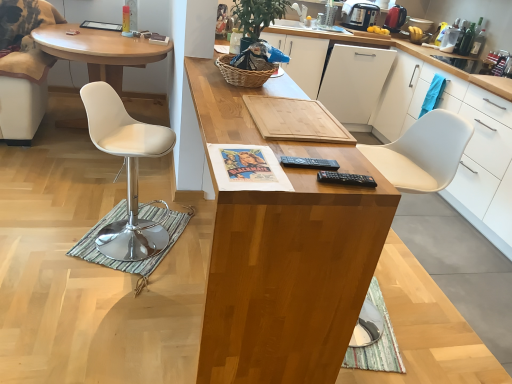
The height and width of the screenshot is (384, 512). In order to click on unoccupied space behind black plastic remote control at center, which appears as the first remote control when viewed from the top in this screenshot , I will do `click(307, 147)`.